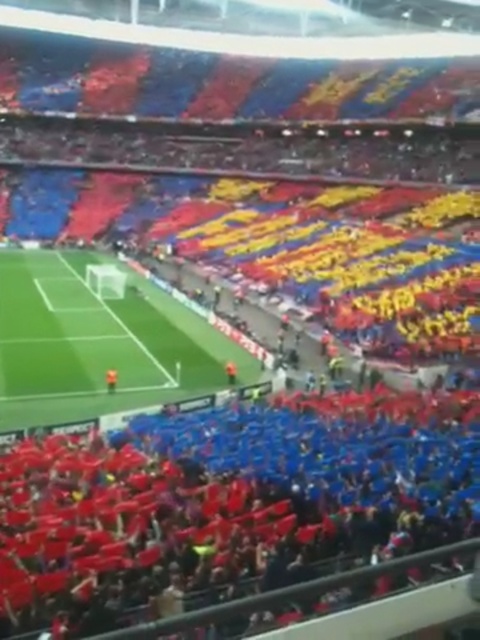
You are a photographer at the stadium. You want to capture a photo that emphasizes the vibrant colors of the red fabric crowd at lower center and the green grass football field at center. Given their sizes, which object will appear smaller in the photo?

The red fabric crowd at lower center will appear smaller in the photo because it occupies less space than the green grass football field at center.

You are a photographer standing at the edge of the field. You want to take a photo that includes both the red fabric crowd at lower center and the green grass football field at center. Which object will appear larger in your photo?

The red fabric crowd at lower center will appear larger in the photo because it is closer to the viewer than the green grass football field at center.

You are a photographer trying to capture the entire scene of the red fabric crowd at lower center and the green grass football field at center. Which object appears wider in the image?

The green grass football field at center appears wider than the red fabric crowd at lower center.